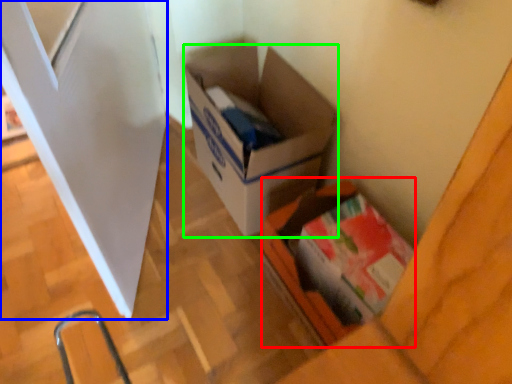
Question: Estimate the real-world distances between objects in this image. Which object is closer to box (highlighted by a red box), screen door (highlighted by a blue box) or box (highlighted by a green box)?

Choices:
 (A) screen door
 (B) box

Answer: (B)